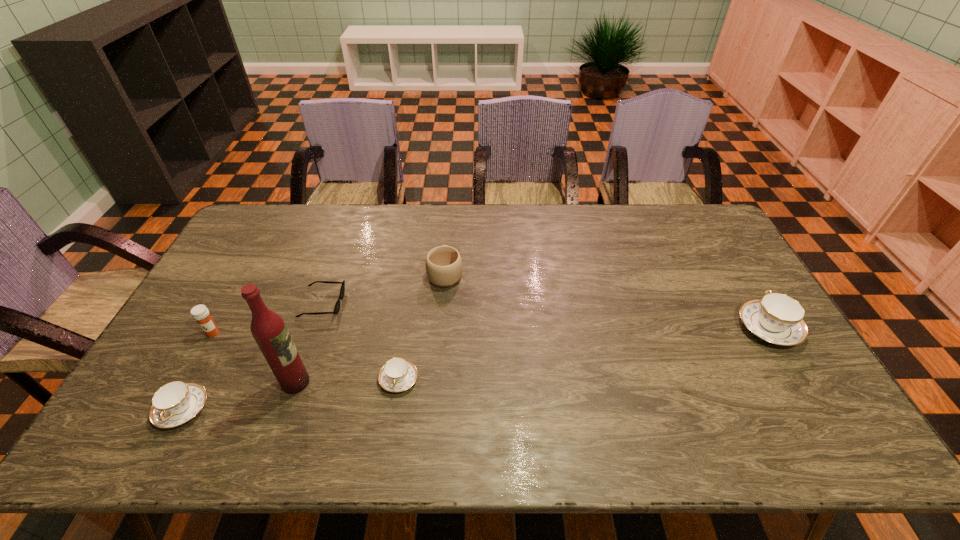
Locate an element on the screen. The height and width of the screenshot is (540, 960). the third shortest object is located at coordinates (175, 403).

Image resolution: width=960 pixels, height=540 pixels. I want to click on the second shortest teacup, so coord(175,403).

The image size is (960, 540). I want to click on the shortest teacup, so click(x=398, y=374).

You are a GUI agent. You are given a task and a screenshot of the screen. Output one action in this format:
    pyautogui.click(x=<x>, y=<y>)
    Task: Click on the second shortest object
    The height and width of the screenshot is (540, 960).
    Given the screenshot: What is the action you would take?
    pyautogui.click(x=398, y=374)

In order to click on the farthest teacup in this screenshot , I will do `click(776, 318)`.

This screenshot has height=540, width=960. What are the coordinates of `the rightmost object` in the screenshot? It's located at (776, 318).

Where is `mug`? The height and width of the screenshot is (540, 960). mug is located at coordinates (443, 263).

Find the location of a particular element. The image size is (960, 540). the tallest object is located at coordinates (268, 328).

In order to click on sunglasses in this screenshot , I will do `click(337, 306)`.

This screenshot has width=960, height=540. Find the location of `medicine`. medicine is located at coordinates (200, 313).